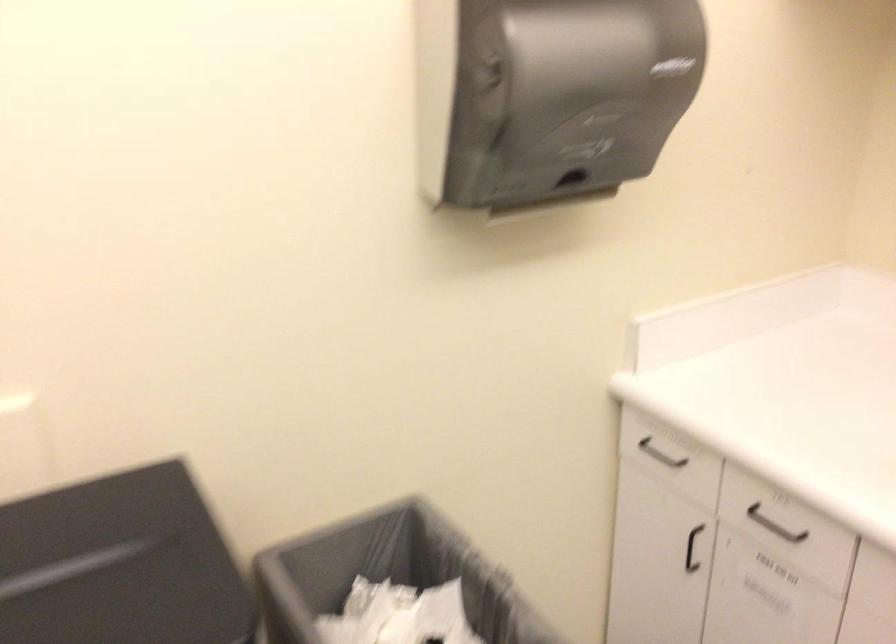
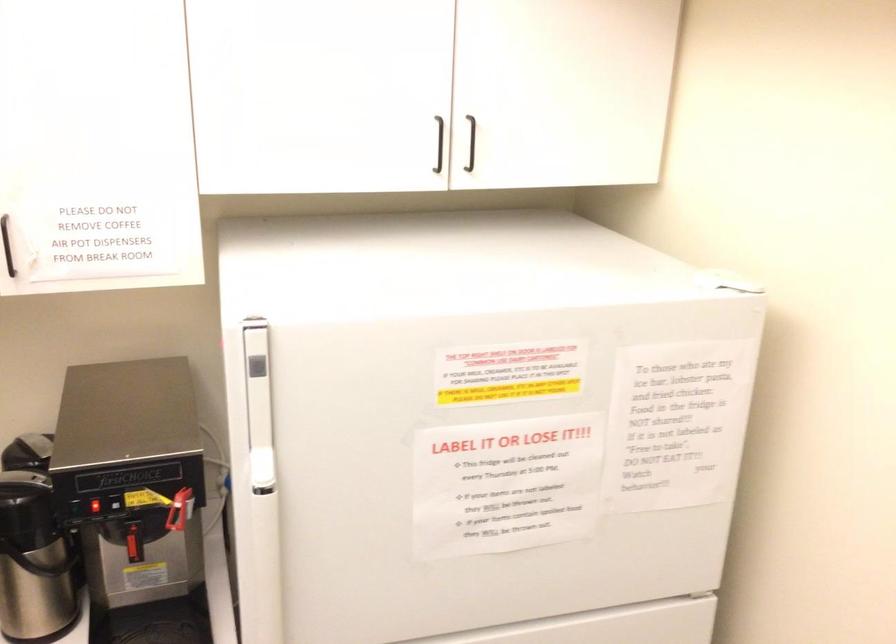
Question: The first image is from the beginning of the video and the second image is from the end. How did the camera likely rotate when shooting the video?

Choices:
 (A) Left
 (B) Right
 (C) Up
 (D) Down

Answer: (B)